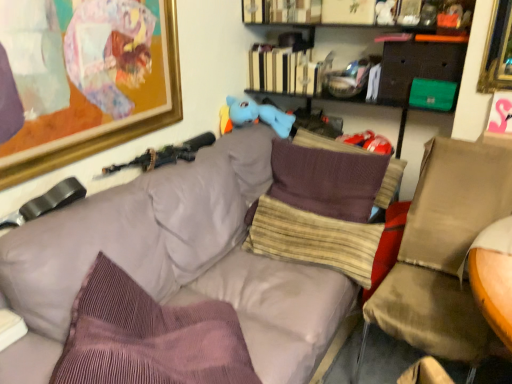
Describe the element at coordinates (256, 115) in the screenshot. This screenshot has width=512, height=384. I see `blue plush toy at upper center` at that location.

What is the approximate height of black plastic rifle at upper left?

It is 9.58 centimeters.

What is the approximate height of gold-framed artwork at upper left?

gold-framed artwork at upper left is 23.05 inches in height.

Where is `hardcover book at upper center`? The image size is (512, 384). hardcover book at upper center is located at coordinates (284, 71).

Which is less distant, (x=311, y=93) or (x=388, y=59)?

Point (x=311, y=93) is positioned farther from the camera compared to point (x=388, y=59).

From a real-world perspective, which object rests below the other?

In real-world perspective, matte black drawer at upper right is lower.

From the image's perspective, which one is positioned lower, hardcover book at upper center or matte black drawer at upper right?

matte black drawer at upper right, from the image's perspective.

Is hardcover book at upper center located outside matte black drawer at upper right?

Absolutely, hardcover book at upper center is external to matte black drawer at upper right.

Locate an element on the screen. The width and height of the screenshot is (512, 384). shelf behind the matte gray couch at center is located at coordinates tap(365, 13).

From the picture: Is matte gray couch at center positioned with its back to wooden bookshelf at upper center?

matte gray couch at center does not have its back to wooden bookshelf at upper center.

Considering the relative sizes of matte gray couch at center and wooden bookshelf at upper center in the image provided, is matte gray couch at center smaller than wooden bookshelf at upper center?

Incorrect, matte gray couch at center is not smaller in size than wooden bookshelf at upper center.

Between point (185, 298) and point (462, 8), which one is positioned behind?

The point (462, 8) is farther from the camera.

Is striped fabric pillow at center, which ranks as the second pillow in front-to-back order, facing towards gold-framed artwork at upper left?

No, striped fabric pillow at center, which ranks as the second pillow in front-to-back order, is not facing towards gold-framed artwork at upper left.

From the image's perspective, starting from the gold-framed artwork at upper left, which pillow is the 2nd one below? Please provide its 2D coordinates.

[(313, 239)]

Is striped fabric pillow at center, which ranks as the second pillow in front-to-back order, far away from gold-framed artwork at upper left?

No, there isn't a large distance between striped fabric pillow at center, which ranks as the second pillow in front-to-back order, and gold-framed artwork at upper left.

From a real-world perspective, which is physically above, striped fabric pillow at center, which ranks as the second pillow in front-to-back order, or gold-framed artwork at upper left?

From a 3D spatial view, gold-framed artwork at upper left is above.

Between wooden bookshelf at upper center and black plastic rifle at upper left, which one has larger width?

wooden bookshelf at upper center.

Considering the positions of objects wooden bookshelf at upper center and black plastic rifle at upper left in the image provided, who is behind, wooden bookshelf at upper center or black plastic rifle at upper left?

wooden bookshelf at upper center is behind.

Which object is positioned more to the left, wooden bookshelf at upper center or black plastic rifle at upper left?

From the viewer's perspective, black plastic rifle at upper left appears more on the left side.

Can you confirm if purple corduroy pillow at center, the first pillow positioned from the front, is smaller than matte gray couch at center?

Yes, purple corduroy pillow at center, the first pillow positioned from the front, is smaller than matte gray couch at center.

From the image's perspective, between purple corduroy pillow at center, which is counted as the third pillow, starting from the back, and matte gray couch at center, which one is located above?

matte gray couch at center, from the image's perspective.

From a real-world perspective, who is located higher, purple corduroy pillow at center, the first pillow positioned from the front, or matte gray couch at center?

purple corduroy pillow at center, the first pillow positioned from the front, from a real-world perspective.

Could you tell me if purple corduroy pillow at center, which is counted as the third pillow, starting from the back, is facing matte gray couch at center?

Yes, purple corduroy pillow at center, which is counted as the third pillow, starting from the back, is facing matte gray couch at center.

Is wooden bookshelf at upper center in front of or behind purple ribbed pillow at center, which is the 3th pillow in front-to-back order, in the image?

Clearly, wooden bookshelf at upper center is in front of purple ribbed pillow at center, which is the 3th pillow in front-to-back order.

Find the location of a particular element. This screenshot has height=384, width=512. shelf above the purple ribbed pillow at center, arranged as the 1th pillow when viewed from the back (from the image's perspective) is located at coordinates (365, 13).

In terms of width, does wooden bookshelf at upper center look wider or thinner when compared to purple ribbed pillow at center, arranged as the 1th pillow when viewed from the back?

wooden bookshelf at upper center is wider than purple ribbed pillow at center, arranged as the 1th pillow when viewed from the back.

Based on the photo, considering the relative positions of wooden bookshelf at upper center and purple ribbed pillow at center, arranged as the 1th pillow when viewed from the back, in the image provided, is wooden bookshelf at upper center to the left of purple ribbed pillow at center, arranged as the 1th pillow when viewed from the back, from the viewer's perspective?

In fact, wooden bookshelf at upper center is to the right of purple ribbed pillow at center, arranged as the 1th pillow when viewed from the back.

Considering the relative sizes of blue plush toy at upper center and black plastic rifle at upper left in the image provided, is blue plush toy at upper center smaller than black plastic rifle at upper left?

No.

Is blue plush toy at upper center positioned beyond the bounds of black plastic rifle at upper left?

Yes, blue plush toy at upper center is located beyond the bounds of black plastic rifle at upper left.

The height and width of the screenshot is (384, 512). Find the location of `toy that is above the black plastic rifle at upper left (from a real-world perspective)`. toy that is above the black plastic rifle at upper left (from a real-world perspective) is located at coordinates (256, 115).

Consider the image. From a real-world perspective, between blue plush toy at upper center and black plastic rifle at upper left, who is vertically lower?

black plastic rifle at upper left.

The image size is (512, 384). Identify the location of book that appears on the left of matte black drawer at upper right. (x=284, y=71).

You are a GUI agent. You are given a task and a screenshot of the screen. Output one action in this format:
    pyautogui.click(x=<x>, y=<y>)
    Task: Click on the shelf above the matte gray couch at center (from the image's perspective)
    This screenshot has height=384, width=512.
    Given the screenshot: What is the action you would take?
    pyautogui.click(x=365, y=13)

Based on their spatial positions, is black plastic rifle at upper left or matte black drawer at upper right further from hardcover book at upper center?

The object further to hardcover book at upper center is black plastic rifle at upper left.

Estimate the real-world distances between objects in this image. Which object is closer to blue plush toy at upper center, striped fabric pillow at center, which ranks as the second pillow in front-to-back order, or brown fabric swivel chair at right?

striped fabric pillow at center, which ranks as the second pillow in front-to-back order, is positioned closer to the anchor blue plush toy at upper center.

Looking at the image, which one is located closer to purple ribbed pillow at center, arranged as the 1th pillow when viewed from the back, black plastic rifle at upper left or wooden bookshelf at upper center?

wooden bookshelf at upper center is positioned closer to the anchor purple ribbed pillow at center, arranged as the 1th pillow when viewed from the back.

Looking at the image, which one is located further to striped fabric pillow at center, the 2th pillow when ordered from back to front, purple ribbed pillow at center, arranged as the 1th pillow when viewed from the back, or purple corduroy pillow at center, the first pillow positioned from the front?

purple corduroy pillow at center, the first pillow positioned from the front, lies further to striped fabric pillow at center, the 2th pillow when ordered from back to front, than the other object.

Based on their spatial positions, is blue plush toy at upper center or black plastic rifle at upper left closer to brown fabric swivel chair at right?

blue plush toy at upper center.

Based on their spatial positions, is purple corduroy pillow at center, the first pillow positioned from the front, or striped fabric pillow at center, which ranks as the second pillow in front-to-back order, closer to gold-framed artwork at upper left?

Based on the image, purple corduroy pillow at center, the first pillow positioned from the front, appears to be nearer to gold-framed artwork at upper left.

Estimate the real-world distances between objects in this image. Which object is closer to purple corduroy pillow at center, which is counted as the third pillow, starting from the back, striped fabric pillow at center, which ranks as the second pillow in front-to-back order, or brown fabric swivel chair at right?

Among the two, striped fabric pillow at center, which ranks as the second pillow in front-to-back order, is located nearer to purple corduroy pillow at center, which is counted as the third pillow, starting from the back.

Looking at the image, which one is located closer to hardcover book at upper center, purple ribbed pillow at center, which is the 3th pillow in front-to-back order, or matte gray couch at center?

purple ribbed pillow at center, which is the 3th pillow in front-to-back order, lies closer to hardcover book at upper center than the other object.

Where is `pillow that lies between wooden bookshelf at upper center and striped fabric pillow at center, which ranks as the second pillow in front-to-back order, from top to bottom`? pillow that lies between wooden bookshelf at upper center and striped fabric pillow at center, which ranks as the second pillow in front-to-back order, from top to bottom is located at coordinates (389, 184).

This screenshot has height=384, width=512. I want to click on picture frame between matte gray couch at center and black plastic rifle at upper left in the front-back direction, so click(87, 79).

Where is `swivel chair between wooden bookshelf at upper center and purple corduroy pillow at center, the first pillow positioned from the front, in the up-down direction`? This screenshot has width=512, height=384. swivel chair between wooden bookshelf at upper center and purple corduroy pillow at center, the first pillow positioned from the front, in the up-down direction is located at coordinates (444, 251).

You are a GUI agent. You are given a task and a screenshot of the screen. Output one action in this format:
    pyautogui.click(x=<x>, y=<y>)
    Task: Click on the shelf between purple corduroy pillow at center, the first pillow positioned from the front, and hardcover book at upper center, along the z-axis
    The image size is (512, 384).
    Given the screenshot: What is the action you would take?
    pyautogui.click(x=365, y=13)